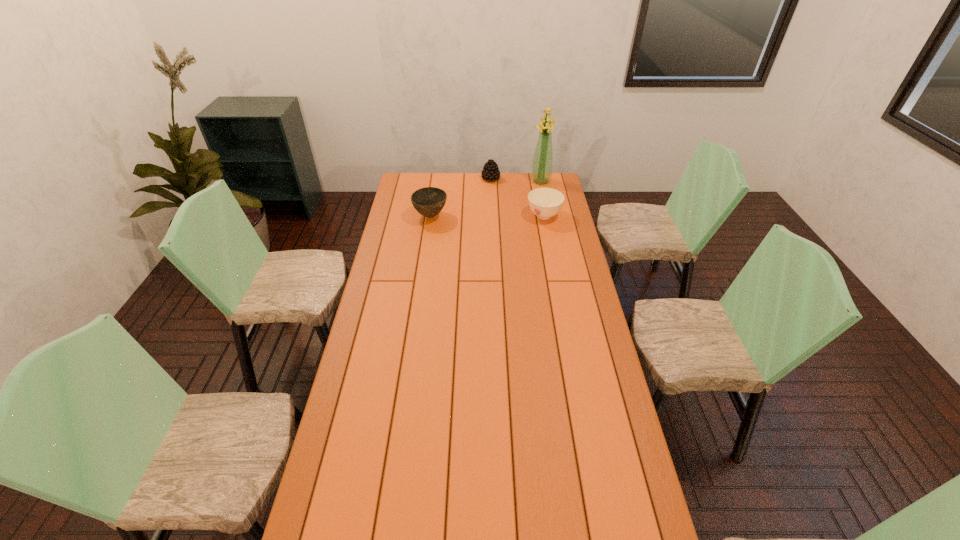
In the image, there is a desktop. At what (x,y) coordinates should I click in order to perform the action: click on blank space at the left edge. Please return your answer as a coordinate pair (x, y). The height and width of the screenshot is (540, 960). Looking at the image, I should click on (381, 299).

In order to click on blank area at the right edge in this screenshot , I will do `click(623, 452)`.

The height and width of the screenshot is (540, 960). Find the location of `vacant space at the near left corner of the desktop`. vacant space at the near left corner of the desktop is located at coordinates (372, 521).

Identify the location of vacant space at the near right corner. The width and height of the screenshot is (960, 540). (618, 512).

The height and width of the screenshot is (540, 960). Find the location of `vacant space in between the pinecone and the tallest object`. vacant space in between the pinecone and the tallest object is located at coordinates (516, 180).

Where is `free space between the sugar bowl and the third object from right to left`? The height and width of the screenshot is (540, 960). free space between the sugar bowl and the third object from right to left is located at coordinates (517, 197).

Locate an element on the screen. Image resolution: width=960 pixels, height=540 pixels. vacant space in between the second object from left to right and the bouquet is located at coordinates (516, 180).

You are a GUI agent. You are given a task and a screenshot of the screen. Output one action in this format:
    pyautogui.click(x=<x>, y=<y>)
    Task: Click on the unoccupied area between the leftmost object and the tallest object
    This screenshot has width=960, height=540.
    Given the screenshot: What is the action you would take?
    pyautogui.click(x=486, y=199)

This screenshot has width=960, height=540. I want to click on free point between the tallest object and the pinecone, so click(x=516, y=180).

The height and width of the screenshot is (540, 960). I want to click on free space that is in between the third object from right to left and the bowl, so click(x=461, y=198).